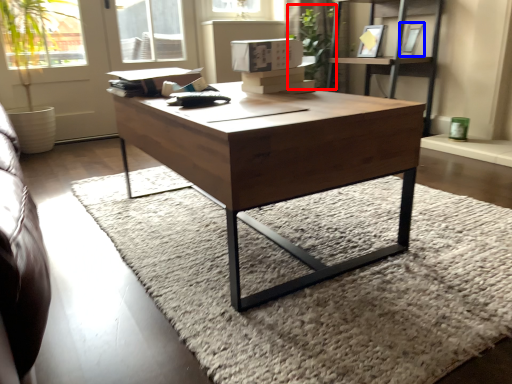
Question: Which point is closer to the camera, plant (highlighted by a red box) or picture frame (highlighted by a blue box)?

Choices:
 (A) plant
 (B) picture frame

Answer: (B)